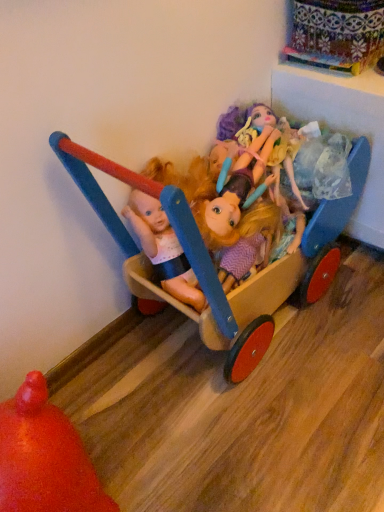
Question: Considering the relative sizes of matte plastic dolls at center and rubberized orange ball at lower left, which is the first toy from left to right, in the image provided, is matte plastic dolls at center taller than rubberized orange ball at lower left, which is the first toy from left to right,?

Choices:
 (A) no
 (B) yes

Answer: (A)

Question: Considering the relative positions of matte plastic dolls at center and rubberized orange ball at lower left, which is the second toy from right to left, in the image provided, is matte plastic dolls at center in front of rubberized orange ball at lower left, which is the second toy from right to left,?

Choices:
 (A) no
 (B) yes

Answer: (A)

Question: From the image's perspective, is matte plastic dolls at center below rubberized orange ball at lower left, which is the second toy from right to left?

Choices:
 (A) yes
 (B) no

Answer: (B)

Question: Considering the relative positions of matte plastic dolls at center and rubberized orange ball at lower left, which is the second toy from right to left, in the image provided, is matte plastic dolls at center to the left of rubberized orange ball at lower left, which is the second toy from right to left, from the viewer's perspective?

Choices:
 (A) yes
 (B) no

Answer: (B)

Question: Is matte plastic dolls at center far from rubberized orange ball at lower left, which is the second toy from right to left?

Choices:
 (A) no
 (B) yes

Answer: (A)

Question: From a real-world perspective, is matte plastic dolls at center physically above rubberized orange ball at lower left, which is the first toy from left to right?

Choices:
 (A) yes
 (B) no

Answer: (A)

Question: Considering the relative sizes of rubberized orange ball at lower left, which is the first toy from left to right, and matte plastic dolls at center in the image provided, is rubberized orange ball at lower left, which is the first toy from left to right, thinner than matte plastic dolls at center?

Choices:
 (A) yes
 (B) no

Answer: (A)

Question: From the image's perspective, is rubberized orange ball at lower left, which is the first toy from left to right, on matte plastic dolls at center?

Choices:
 (A) no
 (B) yes

Answer: (A)

Question: Can you confirm if rubberized orange ball at lower left, which is the second toy from right to left, is smaller than matte plastic dolls at center?

Choices:
 (A) no
 (B) yes

Answer: (A)

Question: Is rubberized orange ball at lower left, which is the first toy from left to right, closer to the viewer compared to matte plastic dolls at center?

Choices:
 (A) no
 (B) yes

Answer: (B)

Question: Does rubberized orange ball at lower left, which is the first toy from left to right, have a greater width compared to matte plastic dolls at center?

Choices:
 (A) no
 (B) yes

Answer: (A)

Question: Is rubberized orange ball at lower left, which is the second toy from right to left, to the right of matte plastic dolls at center from the viewer's perspective?

Choices:
 (A) no
 (B) yes

Answer: (A)

Question: Considering the relative positions of wooden cart at center, which appears as the second toy when viewed from the left, and rubberized orange ball at lower left, which is the second toy from right to left, in the image provided, is wooden cart at center, which appears as the second toy when viewed from the left, in front of rubberized orange ball at lower left, which is the second toy from right to left,?

Choices:
 (A) no
 (B) yes

Answer: (A)